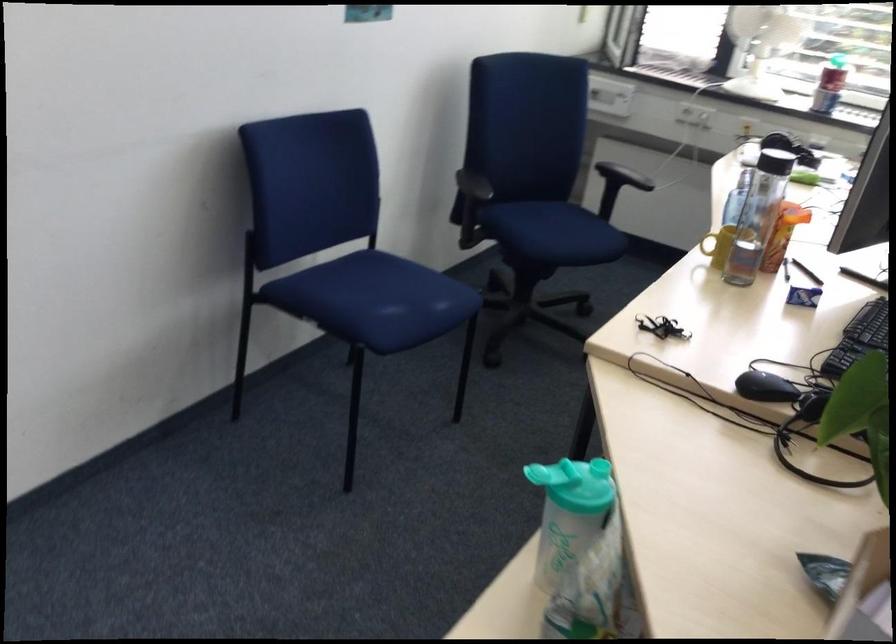
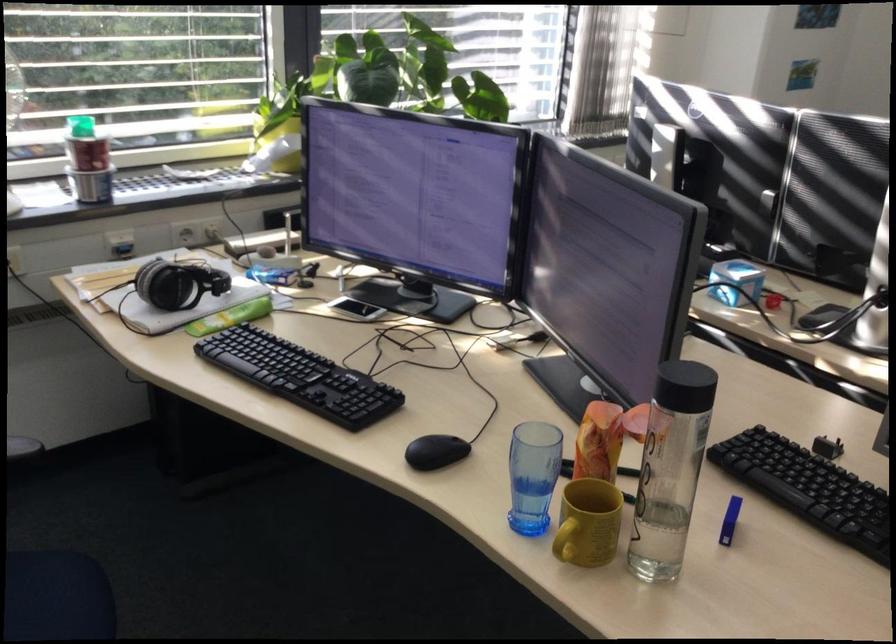
Locate, in the second image, the point that corresponds to point (785, 220) in the first image.

(599, 442)